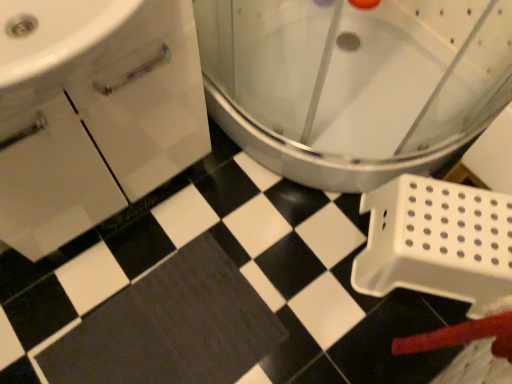
Question: Should I look upward or downward to see white plastic toilet at center?

Choices:
 (A) down
 (B) up

Answer: (B)

Question: From the image's perspective, would you say black matte bath mat at center is shown under white plastic toilet at center?

Choices:
 (A) yes
 (B) no

Answer: (A)

Question: From a real-world perspective, is black matte bath mat at center located beneath white plastic toilet at center?

Choices:
 (A) no
 (B) yes

Answer: (B)

Question: Does black matte bath mat at center have a greater height compared to white plastic toilet at center?

Choices:
 (A) yes
 (B) no

Answer: (B)

Question: Is black matte bath mat at center turned away from white plastic toilet at center?

Choices:
 (A) no
 (B) yes

Answer: (A)

Question: Is the position of black matte bath mat at center more distant than that of white plastic toilet at center?

Choices:
 (A) yes
 (B) no

Answer: (A)

Question: Is white plastic toilet at center surrounded by black matte bath mat at center?

Choices:
 (A) yes
 (B) no

Answer: (B)

Question: From a real-world perspective, is white plastic toilet at center below black matte bath mat at center?

Choices:
 (A) no
 (B) yes

Answer: (A)

Question: From the image's perspective, would you say white plastic toilet at center is positioned over black matte bath mat at center?

Choices:
 (A) yes
 (B) no

Answer: (A)

Question: Considering the relative sizes of white plastic toilet at center and black matte bath mat at center in the image provided, is white plastic toilet at center taller than black matte bath mat at center?

Choices:
 (A) yes
 (B) no

Answer: (A)

Question: Is white plastic toilet at center aimed at black matte bath mat at center?

Choices:
 (A) no
 (B) yes

Answer: (A)

Question: Is black matte bath mat at center a part of white plastic toilet at center?

Choices:
 (A) no
 (B) yes

Answer: (A)

Question: Does white plastic toilet at center come in front of black matte bath mat at center?

Choices:
 (A) yes
 (B) no

Answer: (A)

Question: Is point (391, 77) positioned closer to the camera than point (231, 332)?

Choices:
 (A) closer
 (B) farther

Answer: (B)